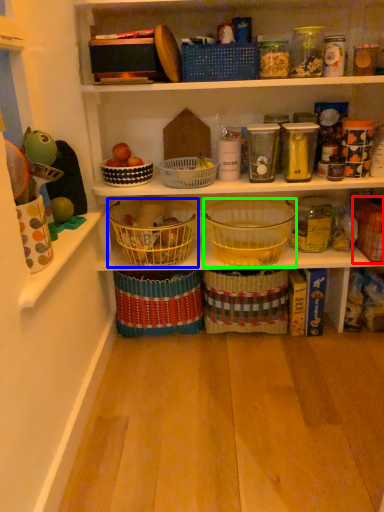
Question: Considering the real-world distances, which object is closest to basket (highlighted by a red box)? basket (highlighted by a blue box) or basket (highlighted by a green box).

Choices:
 (A) basket
 (B) basket

Answer: (B)